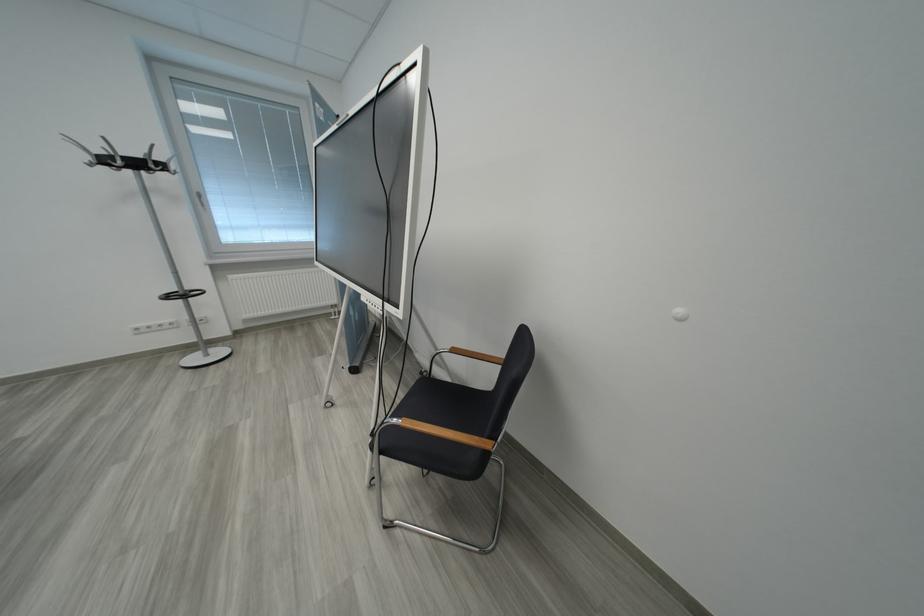
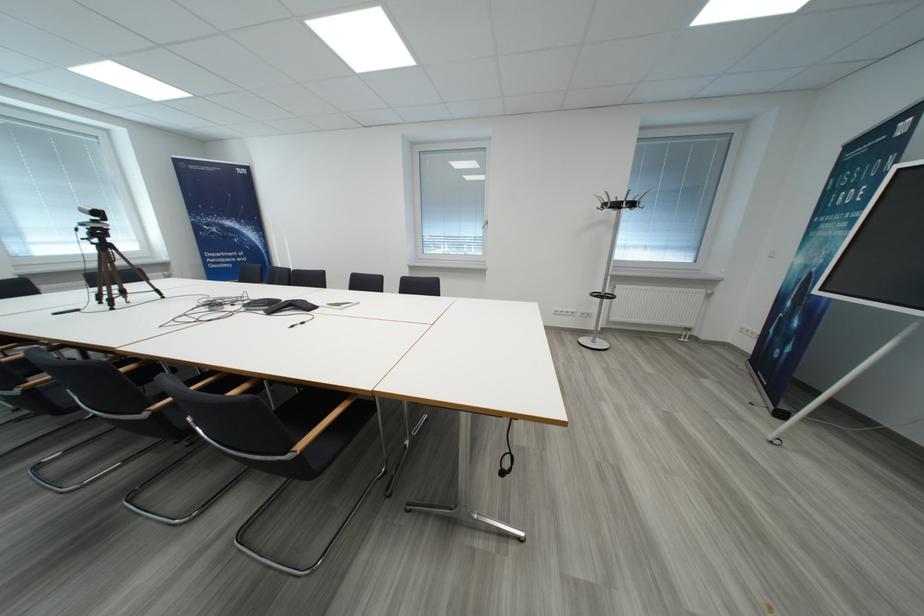
Where in the second image is the point corresponding to [112,163] from the first image?

(623, 208)